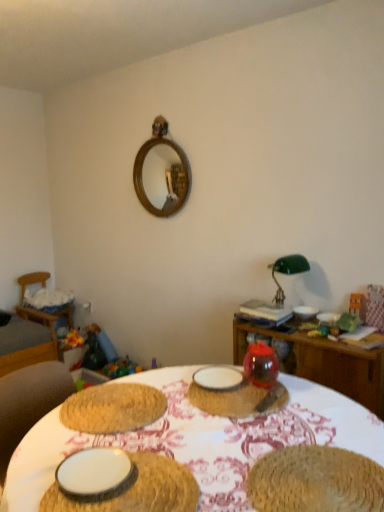
Locate an element on the screen. Image resolution: width=384 pixels, height=512 pixels. wooden mirror at upper center is located at coordinates (161, 173).

Where is `wooden swivel chair at left`? wooden swivel chair at left is located at coordinates (38, 309).

Describe the element at coordinates (287, 272) in the screenshot. I see `green glass table lamp at upper right` at that location.

This screenshot has width=384, height=512. Describe the element at coordinates (305, 312) in the screenshot. I see `translucent glass jar at right, which is counted as the fourth tableware, starting from the bottom` at that location.

Locate an element on the screen. The image size is (384, 512). wooden table at center, the first table when ordered from back to front is located at coordinates (323, 362).

How much space does white woven placemat at center, arranged as the 1th table when viewed from the front, occupy horizontally?

It is 3.63 feet.

You are a GUI agent. You are given a task and a screenshot of the screen. Output one action in this format:
    pyautogui.click(x=<x>, y=<y>)
    Task: Click on the wooden mirror at upper center
    
    Given the screenshot: What is the action you would take?
    pyautogui.click(x=161, y=173)

Is white matte plate at center, the 3th tableware viewed from the front, thinner than braided straw placemat at lower center, placed as the 1th food when sorted from right to left?

Correct, the width of white matte plate at center, the 3th tableware viewed from the front, is less than that of braided straw placemat at lower center, placed as the 1th food when sorted from right to left.

What's the angular difference between white matte plate at center, acting as the 3th tableware starting from the right, and braided straw placemat at lower center, placed as the 1th food when sorted from right to left,'s facing directions?

6.88 degrees separate the facing orientations of white matte plate at center, acting as the 3th tableware starting from the right, and braided straw placemat at lower center, placed as the 1th food when sorted from right to left.

Is white matte plate at center, which is counted as the second tableware, starting from the back, turned away from braided straw placemat at lower center, placed as the 2th food when sorted from left to right?

That's not correct — white matte plate at center, which is counted as the second tableware, starting from the back, is not looking away from braided straw placemat at lower center, placed as the 2th food when sorted from left to right.

Is point (194, 379) positioned after point (292, 450)?

Yes, point (194, 379) is behind point (292, 450).

Is white woven placemat at center, arranged as the 1th table when viewed from the front, beside braided straw placemat at lower center, placed as the 1th food when sorted from right to left?

No, white woven placemat at center, arranged as the 1th table when viewed from the front, is not making contact with braided straw placemat at lower center, placed as the 1th food when sorted from right to left.

Measure the distance between white woven placemat at center, arranged as the second table when viewed from the back, and braided straw placemat at lower center, placed as the 2th food when sorted from left to right.

A distance of 8.64 inches exists between white woven placemat at center, arranged as the second table when viewed from the back, and braided straw placemat at lower center, placed as the 2th food when sorted from left to right.

Relative to braided straw placemat at lower center, placed as the 1th food when sorted from right to left, is white woven placemat at center, arranged as the second table when viewed from the back, in front or behind?

Visually, white woven placemat at center, arranged as the second table when viewed from the back, is located in front of braided straw placemat at lower center, placed as the 1th food when sorted from right to left.

From the image's perspective, count 2nd tables downward from the white matte plate at center, which ranks as the 3th tableware in bottom-to-top order, and point to it. Please provide its 2D coordinates.

[(323, 362)]

Consider the image. Relative to wooden table at center, the first table when ordered from back to front, is white matte plate at center, acting as the second tableware starting from the left, in front or behind?

Clearly, white matte plate at center, acting as the second tableware starting from the left, is in front of wooden table at center, the first table when ordered from back to front.

Which of these two, white matte plate at center, positioned as the 2th tableware in top-to-bottom order, or wooden table at center, the first table when ordered from back to front, is wider?

With larger width is wooden table at center, the first table when ordered from back to front.

Are white matte plate at center, the 3th tableware viewed from the front, and wooden table at center, which is counted as the 2th table, starting from the front, beside each other?

white matte plate at center, the 3th tableware viewed from the front, and wooden table at center, which is counted as the 2th table, starting from the front, are not in contact.

Considering the positions of point (255, 389) and point (372, 475), is point (255, 389) closer or farther from the camera than point (372, 475)?

Point (255, 389) appears to be farther away from the viewer than point (372, 475).

Is there a large distance between translucent glass vase at center, which appears as the second tableware when viewed from the front, and braided straw placemat at lower center, placed as the 1th food when sorted from right to left?

No, there isn't a large distance between translucent glass vase at center, which appears as the second tableware when viewed from the front, and braided straw placemat at lower center, placed as the 1th food when sorted from right to left.

Locate an element on the screen. the 1st food in front of the translucent glass vase at center, which ranks as the third tableware in left-to-right order, starting your count from the anchor is located at coordinates (315, 481).

Can you confirm if translucent glass vase at center, which is the 3th tableware from back to front, is thinner than braided straw placemat at lower center, placed as the 1th food when sorted from right to left?

No, translucent glass vase at center, which is the 3th tableware from back to front, is not thinner than braided straw placemat at lower center, placed as the 1th food when sorted from right to left.

Considering the sizes of objects green glass table lamp at upper right and wooden swivel chair at left in the image provided, who is thinner, green glass table lamp at upper right or wooden swivel chair at left?

green glass table lamp at upper right is thinner.

Is green glass table lamp at upper right behind wooden swivel chair at left?

No, green glass table lamp at upper right is closer to the viewer.

Is wooden swivel chair at left spatially inside white matte plate at lower left, arranged as the second food when viewed from the right, or outside of it?

wooden swivel chair at left is located beyond the bounds of white matte plate at lower left, arranged as the second food when viewed from the right.

Does wooden swivel chair at left come in front of white matte plate at lower left, which is the 1th food in left-to-right order?

That is False.

Find the location of a particular element. The height and width of the screenshot is (512, 384). swivel chair that appears below the white matte plate at lower left, which is the 1th food in left-to-right order (from a real-world perspective) is located at coordinates (38, 309).

Which object is positioned more to the left, wooden swivel chair at left or white matte plate at lower left, arranged as the second food when viewed from the right?

wooden swivel chair at left.

Is wooden swivel chair at left oriented towards translucent glass jar at right, which is the first tableware from top to bottom?

Yes, wooden swivel chair at left faces towards translucent glass jar at right, which is the first tableware from top to bottom.

Is wooden swivel chair at left in contact with translucent glass jar at right, positioned as the 1th tableware in right-to-left order?

wooden swivel chair at left and translucent glass jar at right, positioned as the 1th tableware in right-to-left order, are not in contact.

Which of these two, wooden swivel chair at left or translucent glass jar at right, positioned as the 1th tableware in back-to-front order, is bigger?

wooden swivel chair at left is bigger.

Is wooden swivel chair at left not inside translucent glass jar at right, which is counted as the 4th tableware, starting from the front?

Yes, wooden swivel chair at left is outside of translucent glass jar at right, which is counted as the 4th tableware, starting from the front.

Image resolution: width=384 pixels, height=512 pixels. Find the location of `tableware that is the 2nd object located above the braided straw placemat at lower center, placed as the 1th food when sorted from right to left (from the image's perspective)`. tableware that is the 2nd object located above the braided straw placemat at lower center, placed as the 1th food when sorted from right to left (from the image's perspective) is located at coordinates (218, 378).

Image resolution: width=384 pixels, height=512 pixels. What are the coordinates of `the 2nd food directly above the white woven placemat at center, arranged as the 1th table when viewed from the front (from a real-world perspective)` in the screenshot? It's located at (315, 481).

Which object lies further to the anchor point braided straw placemat at lower center, placed as the 1th food when sorted from right to left, white matte plate at lower left, marked as the 1th tableware in a left-to-right arrangement, or white matte plate at center, the 3th tableware viewed from the front?

white matte plate at center, the 3th tableware viewed from the front.

Considering their positions, is wooden table at center, which is counted as the 2th table, starting from the front, positioned closer to translucent glass jar at right, positioned as the 1th tableware in back-to-front order, than white matte plate at lower left, the 1th tableware in the front-to-back sequence?

Among the two, wooden table at center, which is counted as the 2th table, starting from the front, is located nearer to translucent glass jar at right, positioned as the 1th tableware in back-to-front order.

Based on their spatial positions, is white woven placemat at center, arranged as the second table when viewed from the back, or wooden mirror at upper center further from translucent glass vase at center, which ranks as the third tableware in left-to-right order?

wooden mirror at upper center lies further to translucent glass vase at center, which ranks as the third tableware in left-to-right order, than the other object.

Which object lies further to the anchor point wooden mirror at upper center, white woven placemat at center, arranged as the 1th table when viewed from the front, or translucent glass jar at right, which is the first tableware from top to bottom?

white woven placemat at center, arranged as the 1th table when viewed from the front.

Based on their spatial positions, is white matte plate at center, which is counted as the second tableware, starting from the back, or white woven placemat at center, arranged as the second table when viewed from the back, closer to wooden mirror at upper center?

Based on the image, white matte plate at center, which is counted as the second tableware, starting from the back, appears to be nearer to wooden mirror at upper center.

Considering their positions, is wooden swivel chair at left positioned further to wooden mirror at upper center than translucent glass vase at center, positioned as the 2th tableware in bottom-to-top order?

Among the two, translucent glass vase at center, positioned as the 2th tableware in bottom-to-top order, is located further to wooden mirror at upper center.

From the image, which object appears to be nearer to white matte plate at lower left, which is the 1th food in left-to-right order, white matte plate at center, acting as the 3th tableware starting from the right, or white matte plate at lower left, placed as the fourth tableware when sorted from right to left?

Based on the image, white matte plate at lower left, placed as the fourth tableware when sorted from right to left, appears to be nearer to white matte plate at lower left, which is the 1th food in left-to-right order.

Considering their positions, is white matte plate at center, acting as the 3th tableware starting from the right, positioned closer to white matte plate at lower left, which is the 1th food in left-to-right order, than wooden swivel chair at left?

white matte plate at center, acting as the 3th tableware starting from the right.

Locate an element on the screen. table lamp between translucent glass vase at center, which appears as the second tableware when viewed from the front, and wooden swivel chair at left from front to back is located at coordinates (287, 272).

What are the coordinates of `tableware between white matte plate at lower left, which is the 1th food in left-to-right order, and translucent glass vase at center, which appears as the second tableware when viewed from the front, from front to back` in the screenshot? It's located at (94, 474).

At what (x,y) coordinates should I click in order to perform the action: click on table located between translucent glass vase at center, which ranks as the third tableware in left-to-right order, and wooden swivel chair at left in the depth direction. Please return your answer as a coordinate pair (x, y). Image resolution: width=384 pixels, height=512 pixels. Looking at the image, I should click on (323, 362).

In order to click on table between white matte plate at center, acting as the second tableware starting from the left, and wooden mirror at upper center, along the z-axis in this screenshot , I will do `click(323, 362)`.